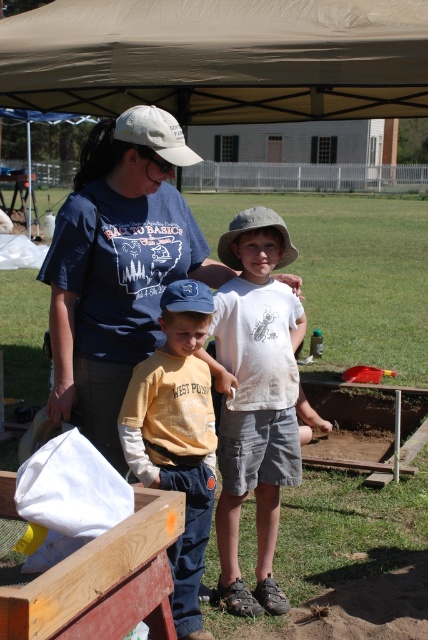
Does yellow cotton shirt at center appear over white fabric baseball cap at upper left?

No.

Looking at this image, which is below, yellow cotton shirt at center or white fabric baseball cap at upper left?

yellow cotton shirt at center

Is point (174, 326) positioned after point (136, 106)?

No.

Find the location of `yellow cotton shirt at center`. yellow cotton shirt at center is located at coordinates click(x=175, y=448).

Does tan fabric canopy at upper center appear on the left side of khaki fabric baseball hat at center?

Correct, you'll find tan fabric canopy at upper center to the left of khaki fabric baseball hat at center.

Does tan fabric canopy at upper center have a greater height compared to khaki fabric baseball hat at center?

Correct, tan fabric canopy at upper center is much taller as khaki fabric baseball hat at center.

Find the location of a particular element. tan fabric canopy at upper center is located at coordinates pyautogui.click(x=219, y=58).

Locate an element on the screen. tan fabric canopy at upper center is located at coordinates (219, 58).

Is blue cotton t-shirt at center to the right of blue fabric baseball cap at center from the viewer's perspective?

Incorrect, blue cotton t-shirt at center is not on the right side of blue fabric baseball cap at center.

Does blue cotton t-shirt at center have a lesser height compared to blue fabric baseball cap at center?

No, blue cotton t-shirt at center is not shorter than blue fabric baseball cap at center.

What do you see at coordinates (118, 266) in the screenshot?
I see `blue cotton t-shirt at center` at bounding box center [118, 266].

Where is `blue cotton t-shirt at center`? This screenshot has width=428, height=640. blue cotton t-shirt at center is located at coordinates point(118,266).